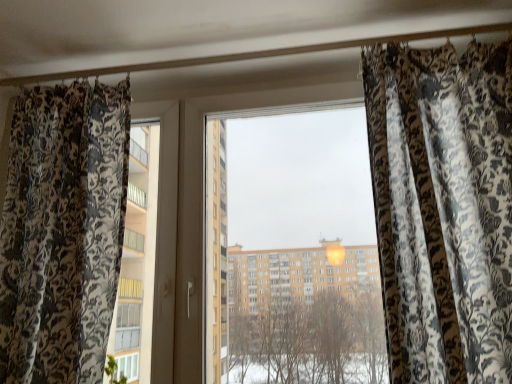
Locate an element on the screen. The height and width of the screenshot is (384, 512). floral-patterned fabric curtain at right is located at coordinates (443, 208).

The image size is (512, 384). What do you see at coordinates (443, 208) in the screenshot?
I see `floral-patterned fabric curtain at right` at bounding box center [443, 208].

Where is `floral-patterned fabric curtain at right`? This screenshot has width=512, height=384. floral-patterned fabric curtain at right is located at coordinates (443, 208).